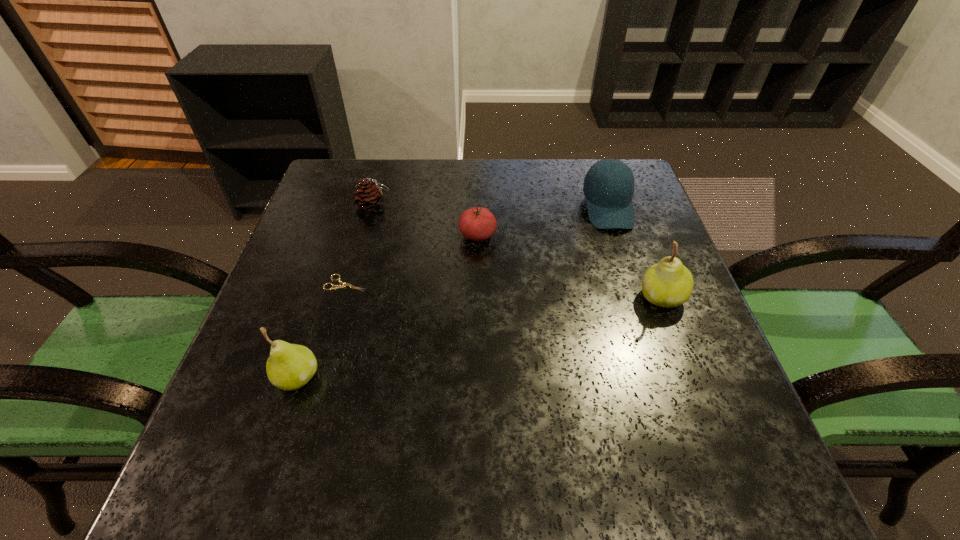
In order to click on pear situated at the right edge in this screenshot , I will do `click(669, 283)`.

Where is `baseball cap present at the right edge`? Image resolution: width=960 pixels, height=540 pixels. baseball cap present at the right edge is located at coordinates (608, 187).

What are the coordinates of `object at the far left corner` in the screenshot? It's located at (369, 196).

Find the location of a particular element. Image resolution: width=960 pixels, height=540 pixels. object that is at the near left corner is located at coordinates (290, 366).

At what (x,y) coordinates should I click in order to perform the action: click on object present at the far right corner. Please return your answer as a coordinate pair (x, y). This screenshot has height=540, width=960. Looking at the image, I should click on (608, 187).

Image resolution: width=960 pixels, height=540 pixels. In the image, there is a desktop. What are the coordinates of `vacant space at the far edge` in the screenshot? It's located at (418, 178).

The image size is (960, 540). Identify the location of vacant space at the near edge of the desktop. (463, 399).

Locate an element on the screen. Image resolution: width=960 pixels, height=540 pixels. free space at the left edge is located at coordinates (348, 212).

This screenshot has height=540, width=960. Identify the location of vacant area at the right edge. (610, 230).

In the image, there is a desktop. Where is `vacant space at the far left corner`? vacant space at the far left corner is located at coordinates (358, 166).